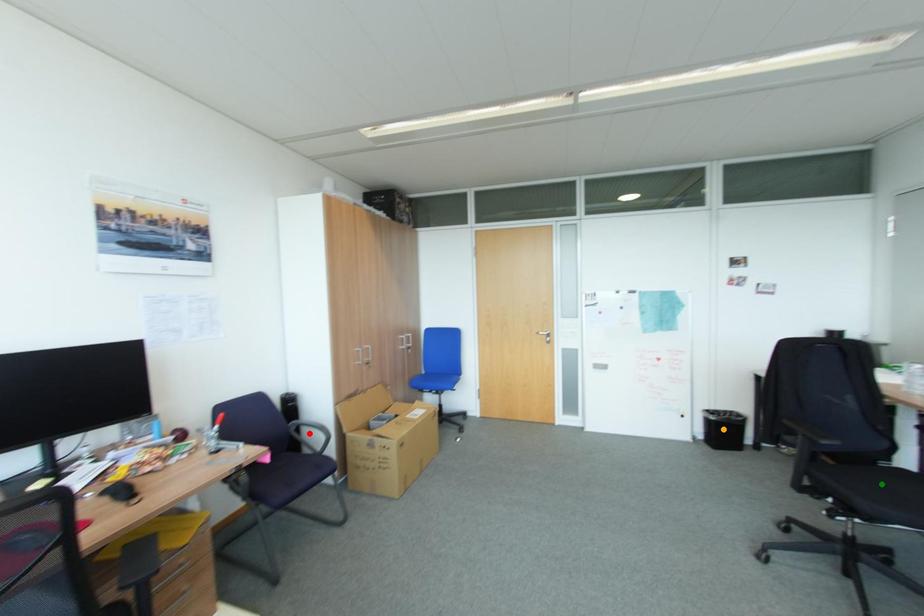
Order these from farthest to nearest:
orange point, green point, red point

orange point < red point < green point